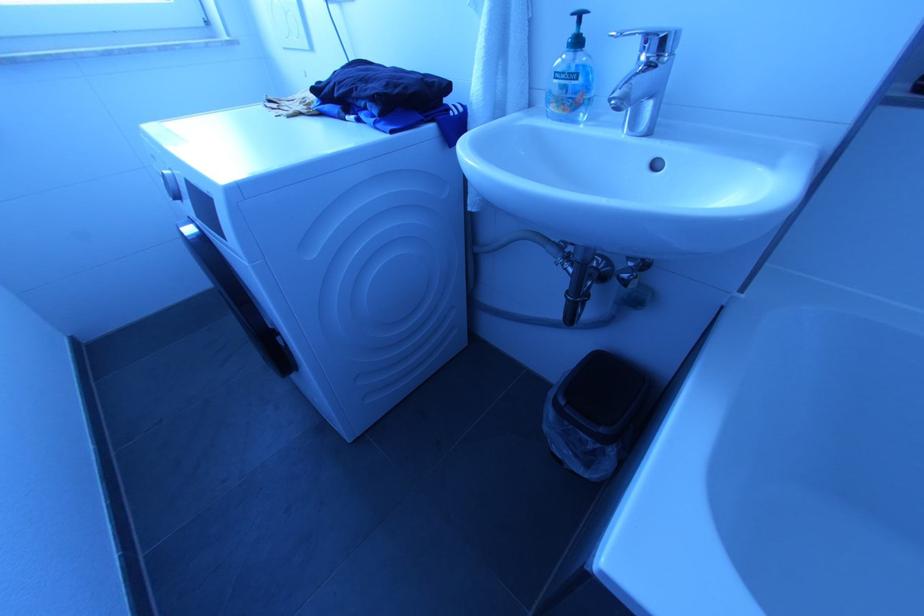
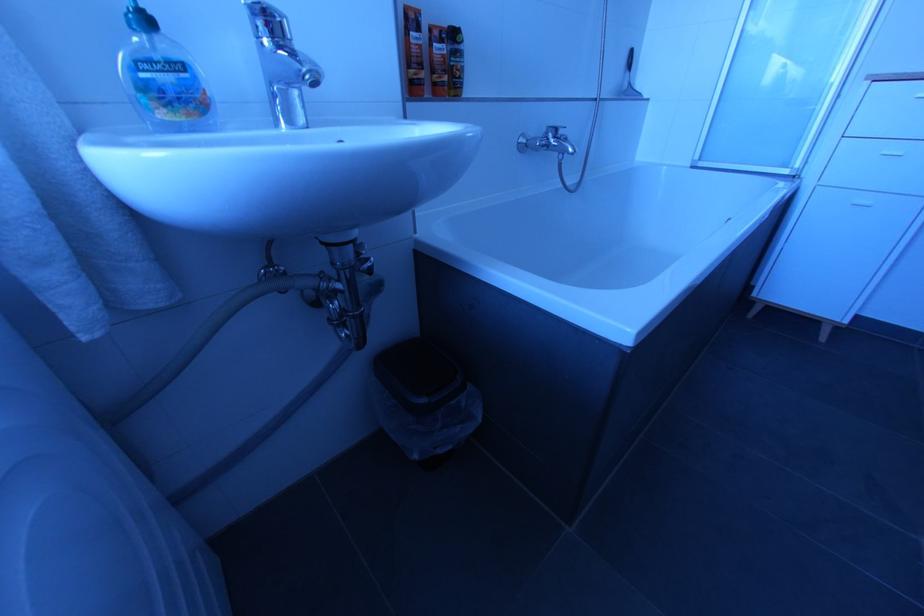
How did the camera likely rotate?

The camera rotated toward right-down.